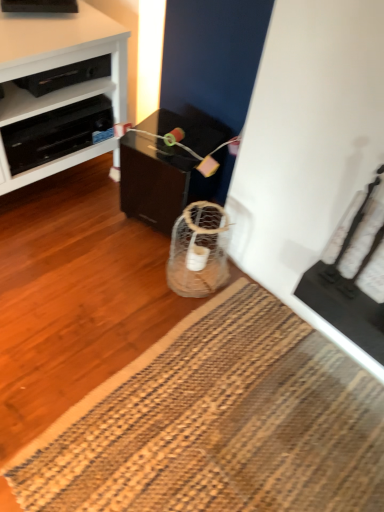
Question: From the image's perspective, is natural fiber mat at lower center located above or below black plastic shelf at upper left?

Choices:
 (A) above
 (B) below

Answer: (B)

Question: From their relative heights in the image, would you say natural fiber mat at lower center is taller or shorter than black plastic shelf at upper left?

Choices:
 (A) short
 (B) tall

Answer: (A)

Question: Estimate the real-world distances between objects in this image. Which object is closer to the black plastic drawer at upper left?

Choices:
 (A) black glossy table at center
 (B) white glossy cabinet at left
 (C) natural fiber mat at lower center
 (D) black plastic shelf at upper left

Answer: (D)

Question: Based on their relative distances, which object is farther from the black glossy table at center?

Choices:
 (A) black plastic shelf at upper left
 (B) white glossy cabinet at left
 (C) natural fiber mat at lower center
 (D) black plastic drawer at upper left

Answer: (C)